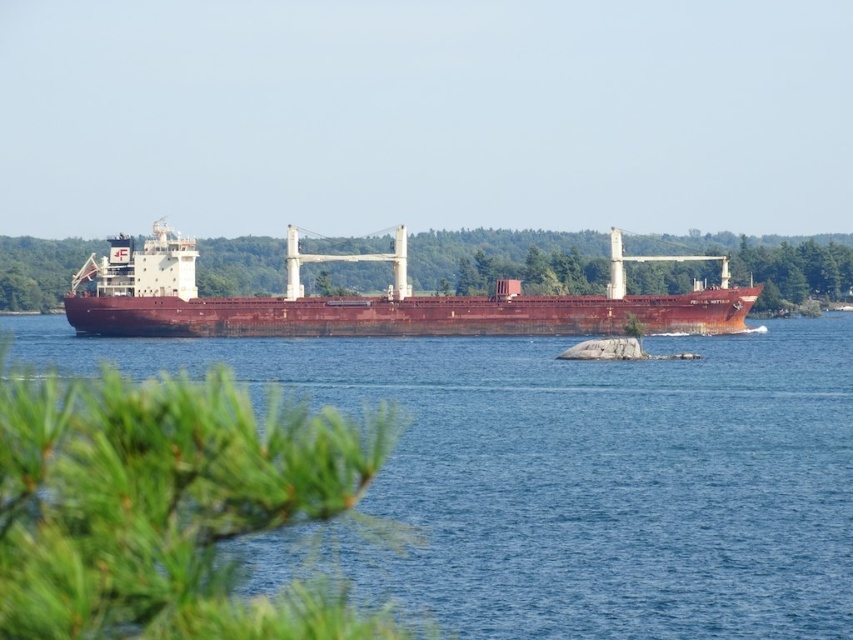
You are standing on the deck of the cargo ship and see the point marked at coordinate point (x=573, y=474). What is the color and material of the object located at this point?

The point (x=573, y=474) marks brown metallic water at center.

Consider the image. You are a crane operator on the rusty metal ship at center, and you need to lower a heavy container into the brown metallic water at center. Given that the crane has a maximum reach of 20 meters, can you safely lower the container into the water without moving the ship?

The brown metallic water at center and rusty metal ship at center are 19.11 meters apart. Since the crane has a maximum reach of 20 meters, the operator can safely lower the container into the brown metallic water at center as the distance is within the crane s maximum reach capability.

You are a sailor on the rusty metal ship at center. You notice the brown metallic water at center below you. Can you confirm if the water is directly beneath the ship?

Yes, the brown metallic water at center is directly below the rusty metal ship at center, so the water is indeed beneath the ship.